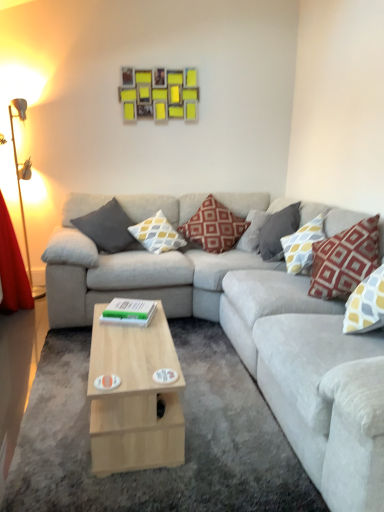
Where is `blank space above light wood/wooden coffee table at center (from a real-world perspective)`? blank space above light wood/wooden coffee table at center (from a real-world perspective) is located at coordinates (136, 342).